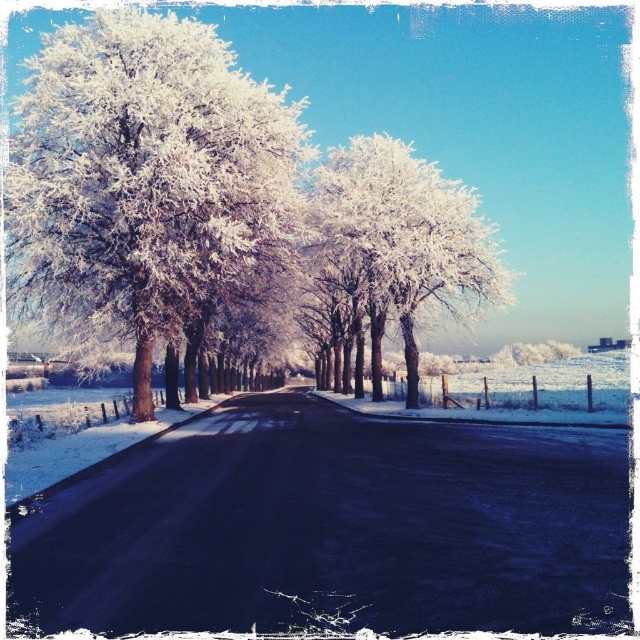
Question: Does frosted white tree at left appear over white frosty tree at center?

Choices:
 (A) yes
 (B) no

Answer: (A)

Question: Does frosted white tree at left appear over white frosty tree at center?

Choices:
 (A) no
 (B) yes

Answer: (B)

Question: Can you confirm if frosted white tree at left is smaller than white frosty tree at center?

Choices:
 (A) yes
 (B) no

Answer: (A)

Question: Which of the following is the farthest from the observer?

Choices:
 (A) (240, 129)
 (B) (470, 221)

Answer: (B)

Question: Which of the following is the farthest from the observer?

Choices:
 (A) frosted white tree at left
 (B) white frosty tree at center

Answer: (B)